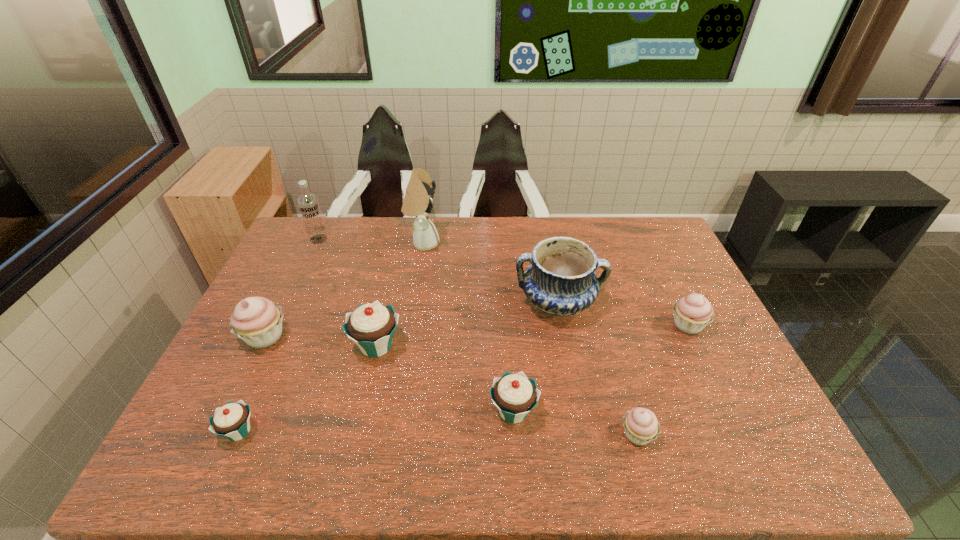
The width and height of the screenshot is (960, 540). Identify the location of the tallest object. (418, 199).

This screenshot has height=540, width=960. I want to click on doll, so click(418, 199).

Where is `the second tallest object`? Image resolution: width=960 pixels, height=540 pixels. the second tallest object is located at coordinates (308, 203).

Locate an element on the screen. Image resolution: width=960 pixels, height=540 pixels. pottery is located at coordinates (560, 280).

I want to click on blue pottery, so click(x=560, y=280).

This screenshot has height=540, width=960. Find the location of `the leftmost pink cupcake`. the leftmost pink cupcake is located at coordinates (257, 321).

Find the location of a particular element. This screenshot has height=540, width=960. the biggest teal cupcake is located at coordinates (371, 326).

The image size is (960, 540). In order to click on the fourth cupcake from right to left in this screenshot , I will do `click(371, 326)`.

Find the location of `the rightmost pink cupcake`. the rightmost pink cupcake is located at coordinates (693, 312).

Find the location of a particular element. the rightmost cupcake is located at coordinates (693, 312).